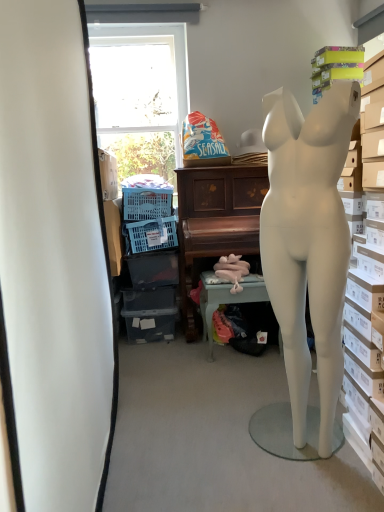
Question: From the image's perspective, would you say blue plastic laundry basket at lower left is shown under wooden piano at center?

Choices:
 (A) yes
 (B) no

Answer: (B)

Question: Would you say blue plastic laundry basket at lower left is a long distance from wooden piano at center?

Choices:
 (A) no
 (B) yes

Answer: (A)

Question: Does blue plastic laundry basket at lower left have a greater width compared to wooden piano at center?

Choices:
 (A) no
 (B) yes

Answer: (A)

Question: From a real-world perspective, is blue plastic laundry basket at lower left on top of wooden piano at center?

Choices:
 (A) no
 (B) yes

Answer: (B)

Question: Is blue plastic laundry basket at lower left at the left side of wooden piano at center?

Choices:
 (A) yes
 (B) no

Answer: (A)

Question: In terms of height, does pink fabric-covered table at center look taller or shorter compared to white matte mannequin at right?

Choices:
 (A) tall
 (B) short

Answer: (B)

Question: From a real-world perspective, is pink fabric-covered table at center positioned above or below white matte mannequin at right?

Choices:
 (A) above
 (B) below

Answer: (B)

Question: Is point (206, 286) positioned closer to the camera than point (319, 184)?

Choices:
 (A) farther
 (B) closer

Answer: (A)

Question: In terms of size, does pink fabric-covered table at center appear bigger or smaller than white matte mannequin at right?

Choices:
 (A) big
 (B) small

Answer: (B)

Question: From a real-world perspective, relative to wooden piano at center, is blue plastic laundry basket at lower left vertically above or below?

Choices:
 (A) below
 (B) above

Answer: (B)

Question: Considering their positions, is blue plastic laundry basket at lower left located in front of or behind wooden piano at center?

Choices:
 (A) front
 (B) behind

Answer: (B)

Question: From the image's perspective, is blue plastic laundry basket at lower left positioned above or below wooden piano at center?

Choices:
 (A) above
 (B) below

Answer: (A)

Question: Is blue plastic laundry basket at lower left to the left or to the right of wooden piano at center in the image?

Choices:
 (A) left
 (B) right

Answer: (A)

Question: Is point (201, 178) closer or farther from the camera than point (273, 207)?

Choices:
 (A) closer
 (B) farther

Answer: (B)

Question: Visually, is wooden piano at center positioned to the left or to the right of white matte mannequin at right?

Choices:
 (A) left
 (B) right

Answer: (A)